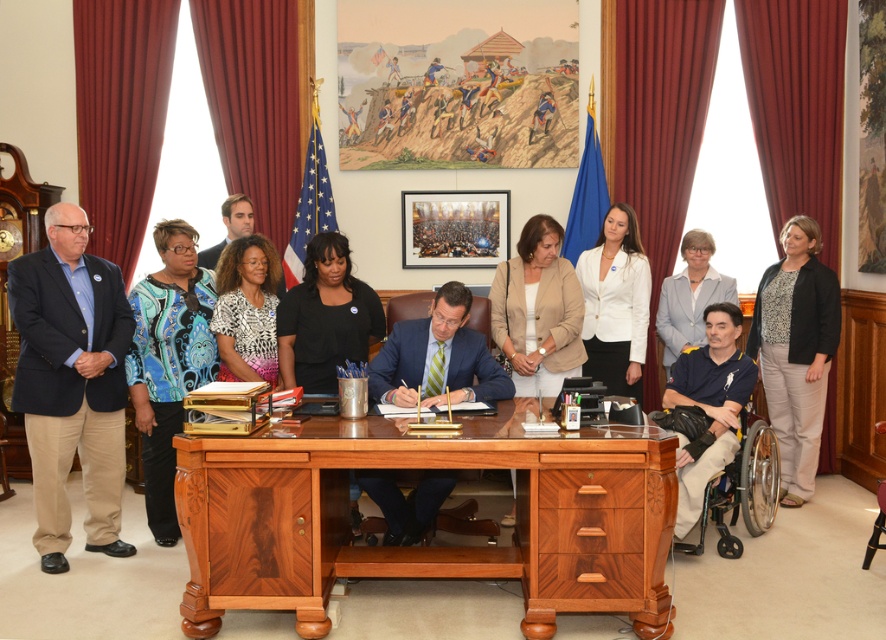
Question: Can you confirm if blue patterned blouse at left is thinner than blue shirt at right?

Choices:
 (A) no
 (B) yes

Answer: (B)

Question: Is matte blue suit at center thinner than blue shirt at right?

Choices:
 (A) yes
 (B) no

Answer: (B)

Question: Is the position of black textured blazer at right more distant than that of silver metallic wheelchair at lower right?

Choices:
 (A) no
 (B) yes

Answer: (B)

Question: Which of the following is the closest to the observer?

Choices:
 (A) white matte blazer at center
 (B) walnut wood desk at center
 (C) blue patterned blouse at left

Answer: (B)

Question: Which object appears closest to the camera in this image?

Choices:
 (A) printed fabric blouse at center
 (B) black textured blazer at right

Answer: (A)

Question: Which point appears farthest from the camera in this image?

Choices:
 (A) (158, 502)
 (B) (375, 371)
 (C) (688, 275)

Answer: (C)